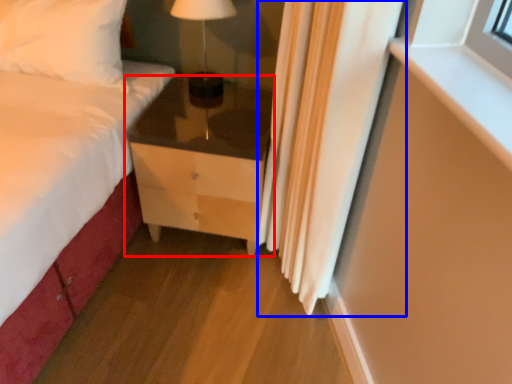
Question: Among these objects, which one is nearest to the camera, chest of drawers (highlighted by a red box) or curtain (highlighted by a blue box)?

Choices:
 (A) chest of drawers
 (B) curtain

Answer: (B)